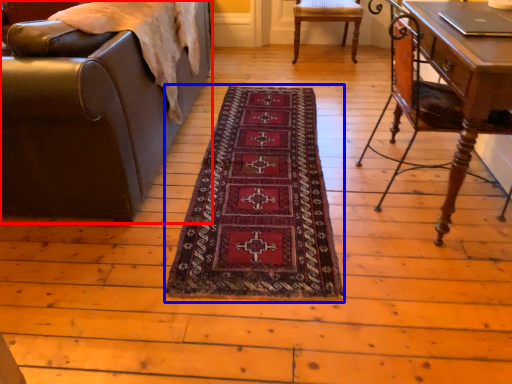
Question: Which object is closer to the camera taking this photo, chair (highlighted by a red box) or mat (highlighted by a blue box)?

Choices:
 (A) chair
 (B) mat

Answer: (A)